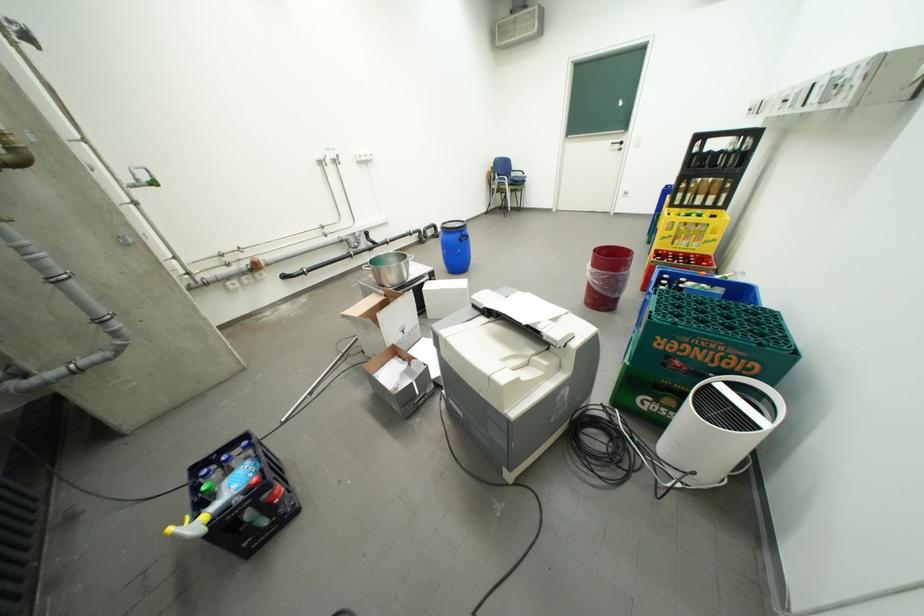
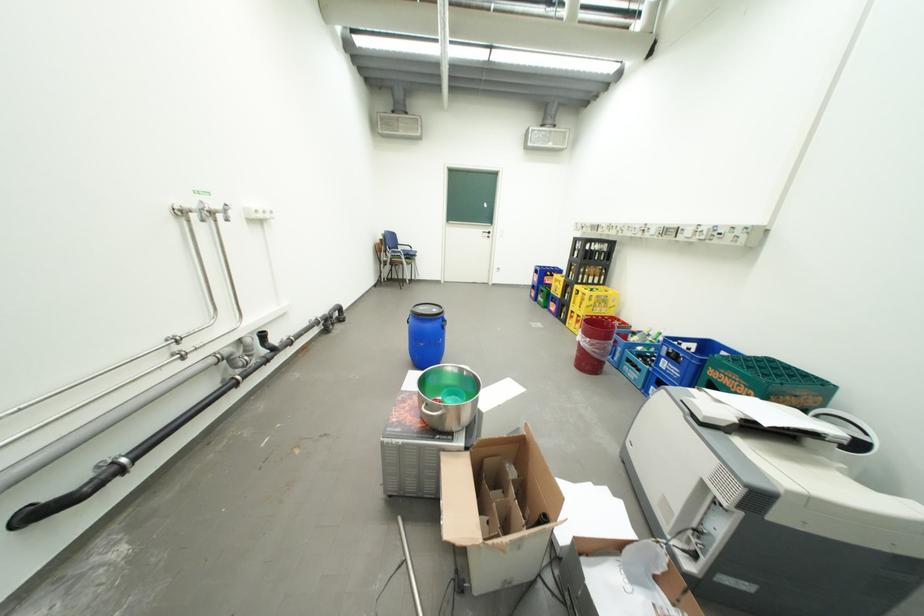
The point at (602, 269) is marked in the first image. Where is the corresponding point in the second image?

(599, 341)